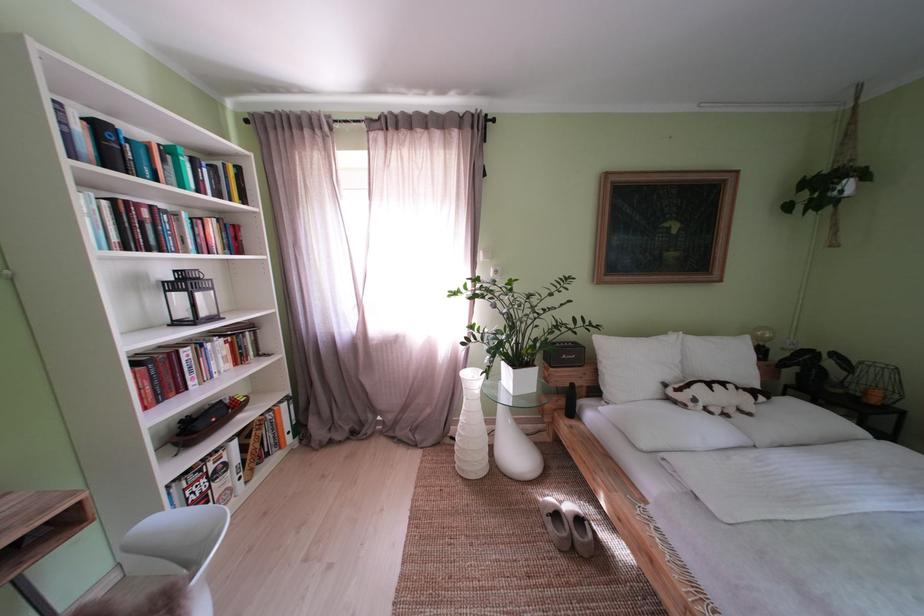
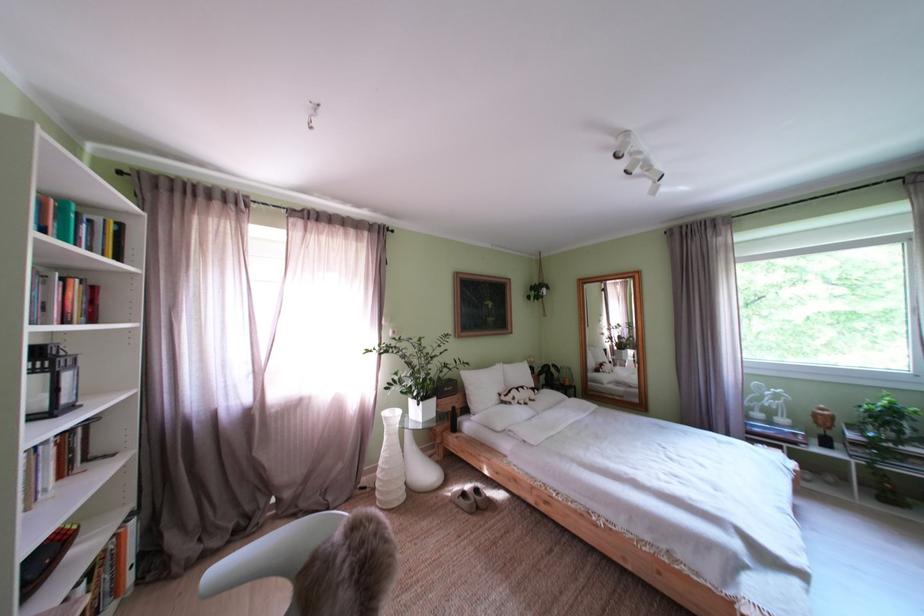
Where in the second image is the point corresponding to [706,406] from the first image?

(525, 405)